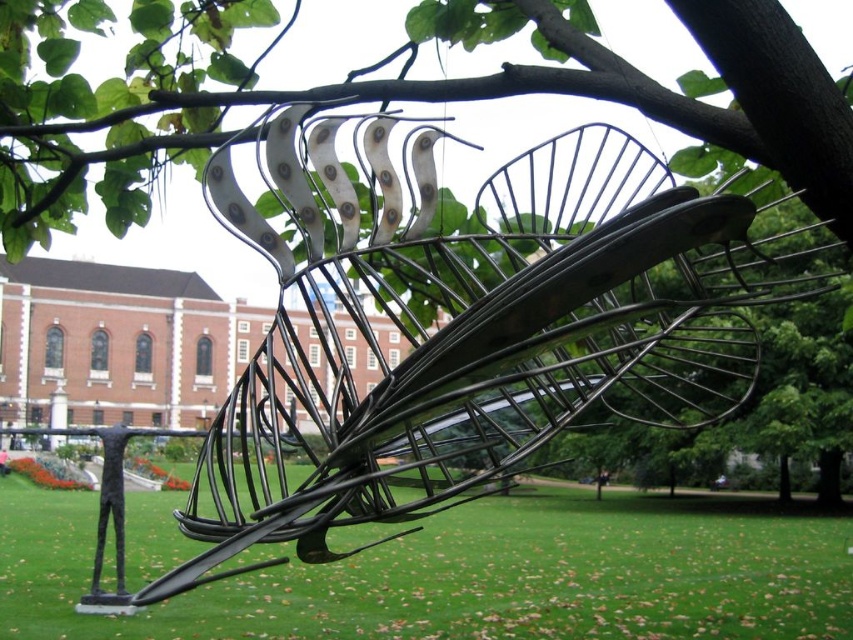
Question: Which object appears closest to the camera in this image?

Choices:
 (A) black wire sculpture at center
 (B) green grass at lower center

Answer: (A)

Question: Which point is closer to the camera?

Choices:
 (A) (84, 522)
 (B) (258, 129)

Answer: (B)

Question: Is black wire sculpture at center thinner than green grass at lower center?

Choices:
 (A) yes
 (B) no

Answer: (A)

Question: Among these points, which one is farthest from the camera?

Choices:
 (A) (363, 401)
 (B) (737, 593)

Answer: (B)

Question: Can you confirm if black wire sculpture at center is positioned below green grass at lower center?

Choices:
 (A) yes
 (B) no

Answer: (B)

Question: Does black wire sculpture at center have a smaller size compared to green grass at lower center?

Choices:
 (A) no
 (B) yes

Answer: (A)